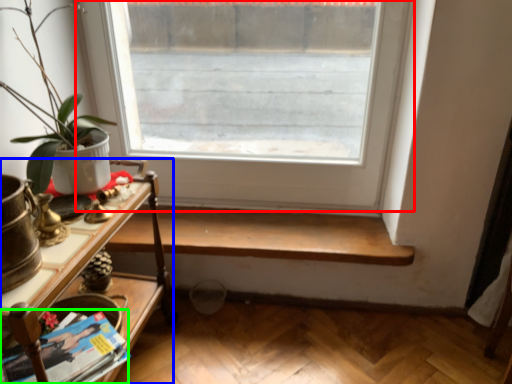
Question: Based on their relative distances, which object is nearer to window (highlighted by a red box)? Choose from table (highlighted by a blue box) and magazine (highlighted by a green box).

Choices:
 (A) table
 (B) magazine

Answer: (A)